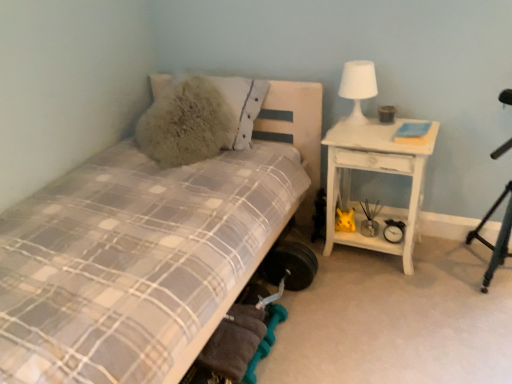
Question: Is fuzzy beige pillow at upper left thinner than plaid fabric bed at left?

Choices:
 (A) no
 (B) yes

Answer: (B)

Question: Can you confirm if fuzzy beige pillow at upper left is wider than plaid fabric bed at left?

Choices:
 (A) no
 (B) yes

Answer: (A)

Question: Could you tell me if fuzzy beige pillow at upper left is facing plaid fabric bed at left?

Choices:
 (A) yes
 (B) no

Answer: (A)

Question: Are fuzzy beige pillow at upper left and plaid fabric bed at left located far from each other?

Choices:
 (A) no
 (B) yes

Answer: (A)

Question: Does fuzzy beige pillow at upper left have a lesser height compared to plaid fabric bed at left?

Choices:
 (A) no
 (B) yes

Answer: (B)

Question: From a real-world perspective, is fuzzy beige pillow at upper left located higher than plaid fabric bed at left?

Choices:
 (A) no
 (B) yes

Answer: (B)

Question: Is fuzzy beige pillow at upper left directly adjacent to white matte table lamp at upper right?

Choices:
 (A) no
 (B) yes

Answer: (A)

Question: Is fuzzy beige pillow at upper left at the right side of white matte table lamp at upper right?

Choices:
 (A) no
 (B) yes

Answer: (A)

Question: Are fuzzy beige pillow at upper left and white matte table lamp at upper right far apart?

Choices:
 (A) no
 (B) yes

Answer: (A)

Question: From the image's perspective, is fuzzy beige pillow at upper left located beneath white matte table lamp at upper right?

Choices:
 (A) no
 (B) yes

Answer: (B)

Question: Could white matte table lamp at upper right be considered to be inside fuzzy beige pillow at upper left?

Choices:
 (A) yes
 (B) no

Answer: (B)

Question: Is fuzzy beige pillow at upper left turned away from white matte table lamp at upper right?

Choices:
 (A) yes
 (B) no

Answer: (B)

Question: Is white wood nightstand at right facing away from fuzzy beige pillow at upper left?

Choices:
 (A) no
 (B) yes

Answer: (A)